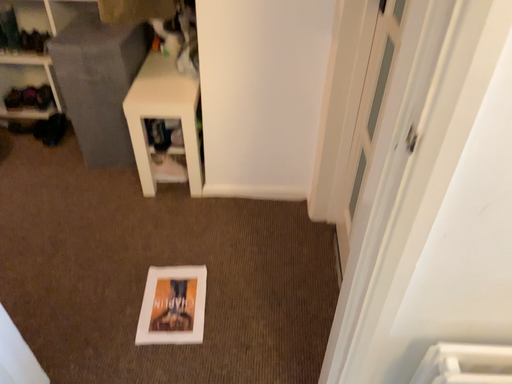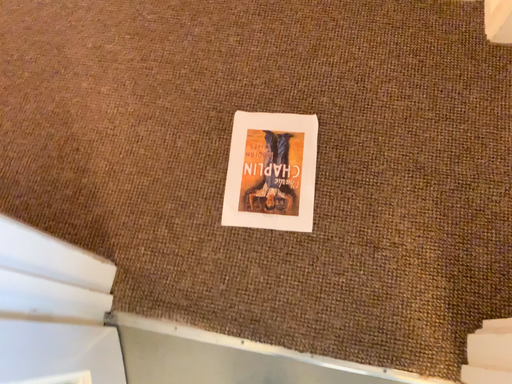
Question: Which way did the camera rotate in the video?

Choices:
 (A) rotated left
 (B) rotated right

Answer: (A)